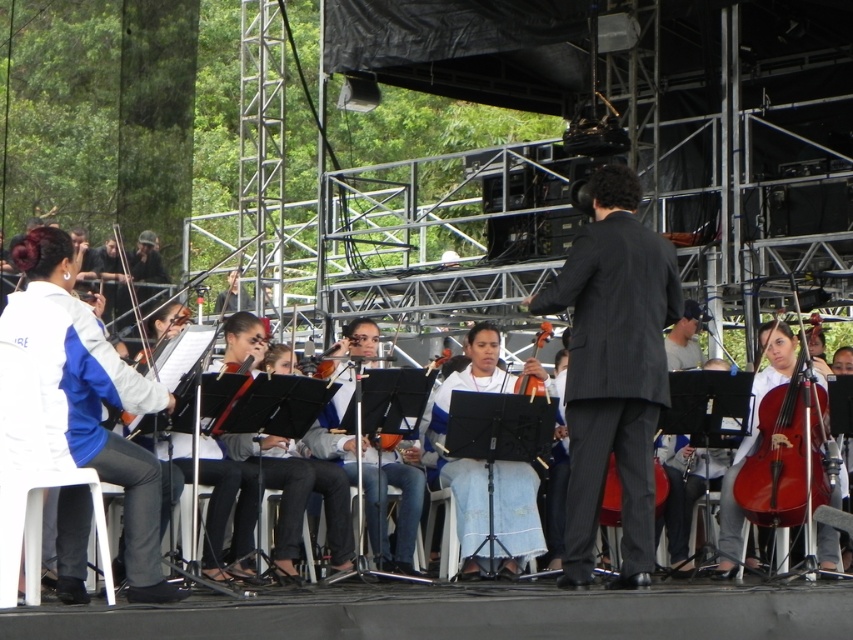
Question: Which point is farther from the camera taking this photo?

Choices:
 (A) (213, 428)
 (B) (532, 301)
 (C) (761, 483)
 (D) (323, 360)

Answer: (D)

Question: Does shiny brown violin at center have a greater width compared to matte black violin at center?

Choices:
 (A) yes
 (B) no

Answer: (B)

Question: Observing the image, what is the correct spatial positioning of matte orange violin at center in reference to matte black violin at center?

Choices:
 (A) right
 (B) left

Answer: (A)

Question: Which object is closer to the camera taking this photo?

Choices:
 (A) matte black violin at center
 (B) shiny red wood cello at right
 (C) shiny brown violin at center

Answer: (C)

Question: Is shiny red wood cello at right positioned behind matte black violin at center?

Choices:
 (A) no
 (B) yes

Answer: (A)

Question: Estimate the real-world distances between objects in this image. Which object is closer to the shiny brown violin at center?

Choices:
 (A) matte orange violin at center
 (B) shiny red wood cello at right
 (C) matte black violin at center
 (D) dark gray pinstripe suit at center

Answer: (C)